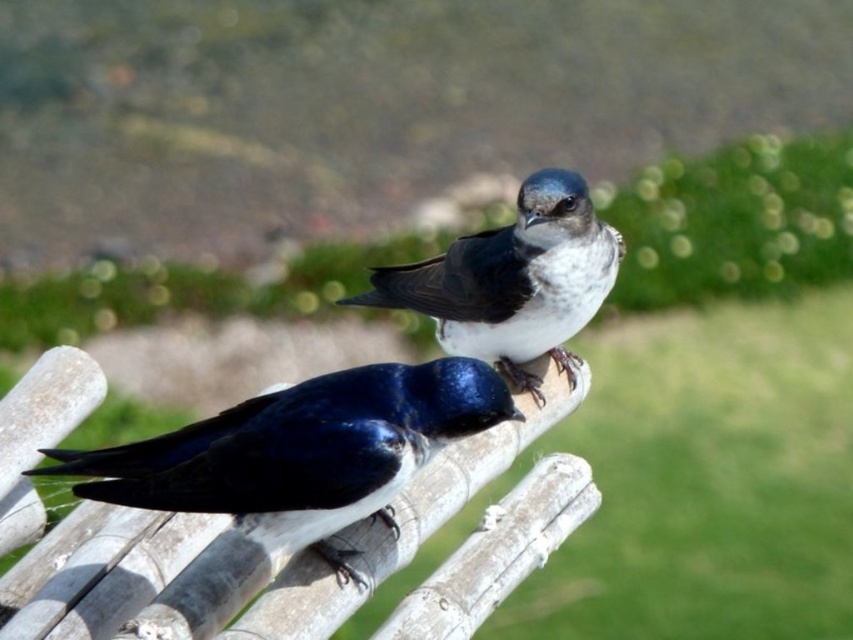
From the picture: Can you confirm if shiny blue bird at center is shorter than white glossy bird at center?

Indeed, shiny blue bird at center has a lesser height compared to white glossy bird at center.

Does shiny blue bird at center have a larger size compared to white glossy bird at center?

Actually, shiny blue bird at center might be smaller than white glossy bird at center.

What do you see at coordinates (299, 442) in the screenshot? I see `shiny blue bird at center` at bounding box center [299, 442].

This screenshot has width=853, height=640. In order to click on shiny blue bird at center in this screenshot , I will do `click(299, 442)`.